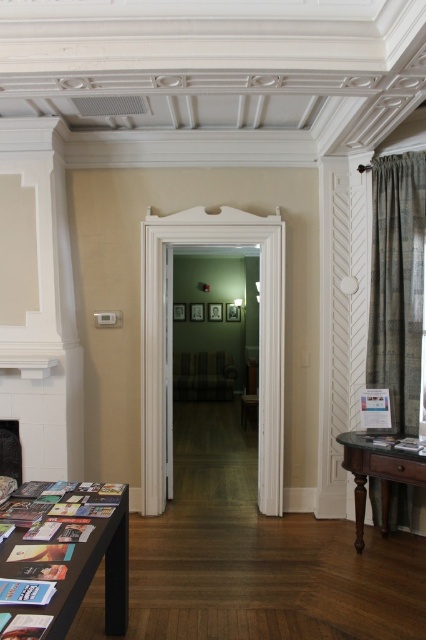
You are a guest entering the room and want to pass through the doorway. There is a textured green curtain at right and a mahogany wood table at right near the entrance. Which object is closer to the doorway, making it easier to navigate around?

The textured green curtain at right occupies less space than the mahogany wood table at right, so the curtain is closer to the doorway and easier to navigate around.

You are planning to move a large painting that is 1.5 meters wide into the space between the textured green curtain at right and the mahogany wood table at right. Based on the scene description, will the painting fit in that space?

The textured green curtain at right has a lesser width compared to mahogany wood table at right. Since the painting is 1.5 meters wide, the space between them may not be sufficient if the combined width of both objects exceeds the available space. However, without specific measurements of the space itself, it is difficult to determine definitively.